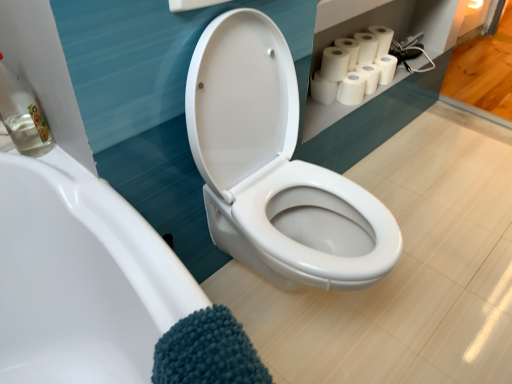
Question: In terms of size, does white matte toilet paper at upper right, marked as the second toilet paper in a right-to-left arrangement, appear bigger or smaller than clear glass bottle at left?

Choices:
 (A) big
 (B) small

Answer: (B)

Question: Is white matte toilet paper at upper right, marked as the second toilet paper in a right-to-left arrangement, inside the boundaries of clear glass bottle at left, or outside?

Choices:
 (A) outside
 (B) inside

Answer: (A)

Question: Which is nearer to the clear glass bottle at left?

Choices:
 (A) white matte paper towel at upper right
 (B) white matte toilet paper at upper right, marked as the fourth toilet paper in a right-to-left arrangement
 (C) white matte toilet paper at upper right, positioned as the sixth toilet paper in right-to-left order
 (D) white matte toilet paper at upper right, placed as the 7th toilet paper when sorted from right to left
 (E) white matte toilet paper at upper right, the 3th toilet paper when ordered from right to left

Answer: (D)

Question: Which is farther from the white matte toilet paper at upper right, the fifth toilet paper in the left-to-right sequence?

Choices:
 (A) white matte toilet paper at upper right, which is the fourth toilet paper from left to right
 (B) clear glass bottle at left
 (C) white matte toilet paper at upper right, the 5th toilet paper in the right-to-left sequence
 (D) white matte paper towel at upper right
 (E) white matte toilet paper at upper right, positioned as the sixth toilet paper in right-to-left order

Answer: (B)